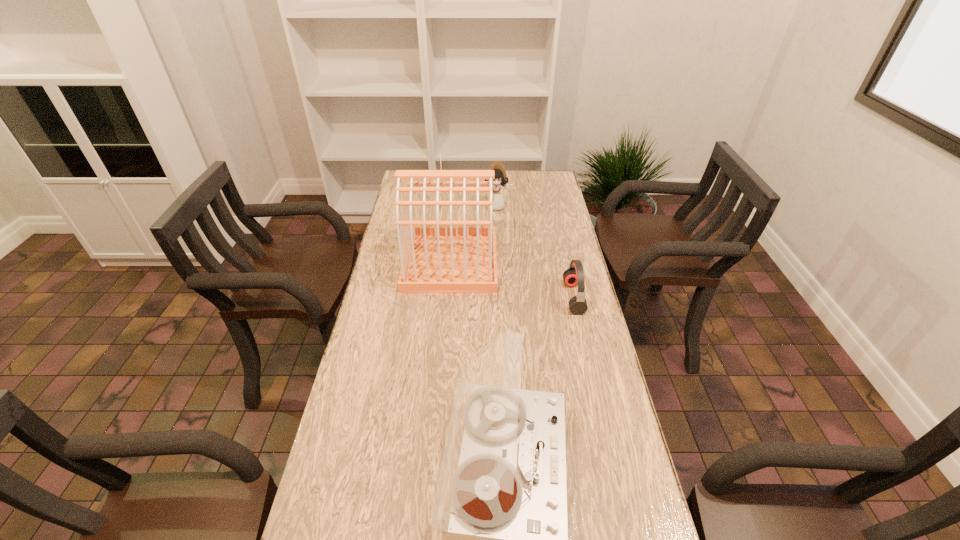
Identify which object is the third closest to the second shortest object. Please provide its 2D coordinates. Your answer should be formatted as a tuple, i.e. [(x, y)], where the tuple contains the x and y coordinates of a point satisfying the conditions above.

[(501, 496)]

Identify the location of the closest object to the farthest object. [436, 259].